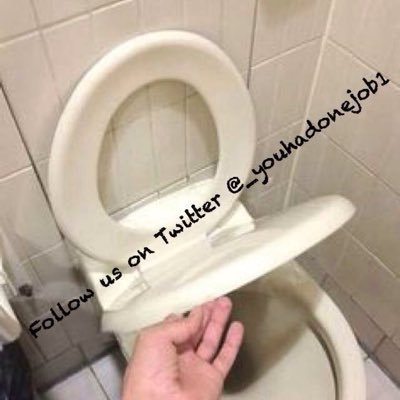
Image resolution: width=400 pixels, height=400 pixels. Find the location of `toilet cover`. toilet cover is located at coordinates (267, 246).